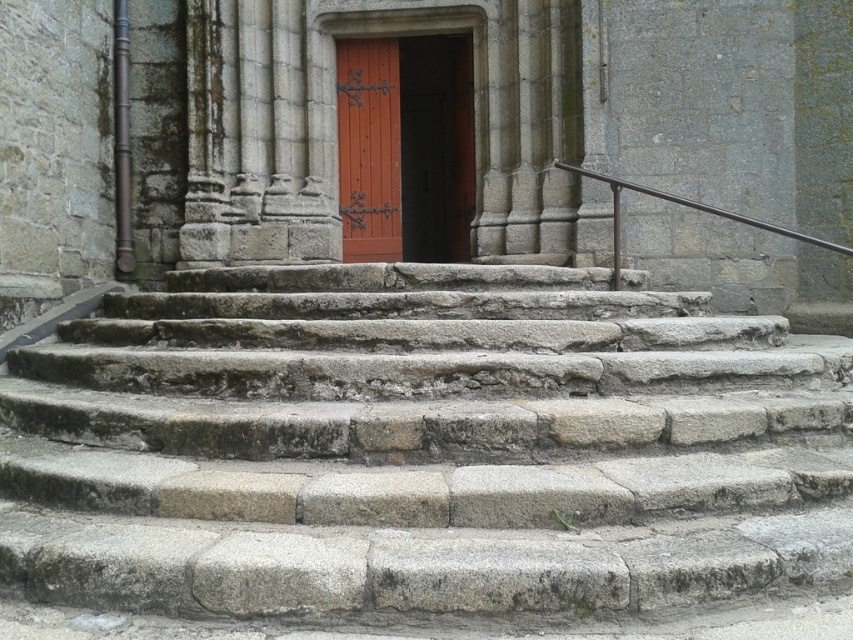
Between gray stone stairs at center and smooth reddish-brown wooden door at center, which one appears on the left side from the viewer's perspective?

Positioned to the left is smooth reddish-brown wooden door at center.

Which is in front, point (370, 600) or point (341, 209)?

Positioned in front is point (370, 600).

Which is in front, point (158, 593) or point (396, 172)?

Point (158, 593) is more forward.

Where is `gray stone stairs at center`? gray stone stairs at center is located at coordinates (424, 460).

Does smooth reddish-brown wooden door at center have a larger size compared to black metal railing at upper right?

Actually, smooth reddish-brown wooden door at center might be smaller than black metal railing at upper right.

Can you confirm if smooth reddish-brown wooden door at center is positioned below black metal railing at upper right?

No.

Is point (386, 140) positioned in front of point (802, 240)?

No.

Locate an element on the screen. The width and height of the screenshot is (853, 640). smooth reddish-brown wooden door at center is located at coordinates (368, 148).

Does gray stone stairs at center have a greater height compared to matte orange door at center?

No.

Who is more forward, (351, 486) or (424, 225)?

Point (351, 486)

Find the location of a particular element. The image size is (853, 640). gray stone stairs at center is located at coordinates (424, 460).